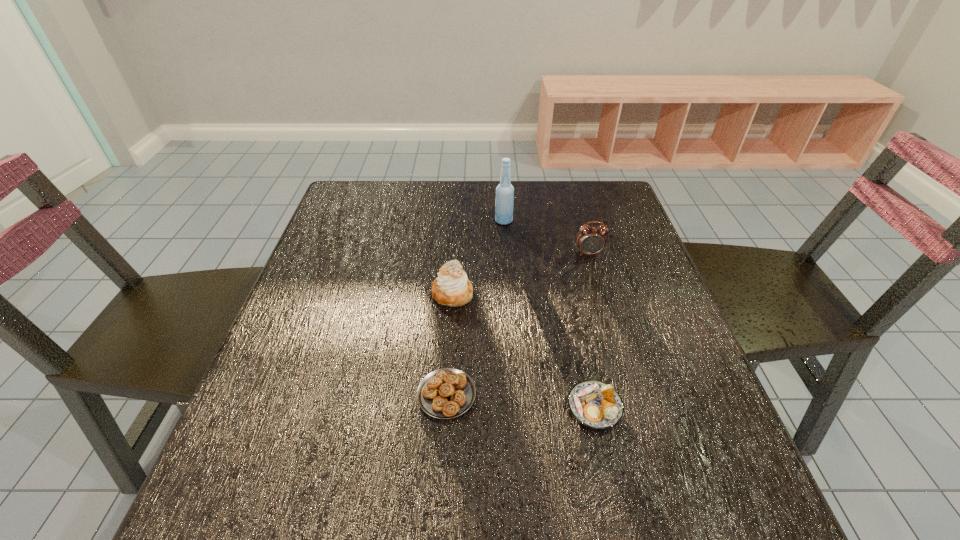
Find the location of a particular element. free space between the rightmost pastry and the tallest object is located at coordinates (549, 314).

At what (x,y) coordinates should I click in order to perform the action: click on free space between the shortest object and the tallest object. Please return your answer as a coordinate pair (x, y). This screenshot has width=960, height=540. Looking at the image, I should click on (475, 307).

The image size is (960, 540). In order to click on vacant point located between the rightmost pastry and the second farthest object in this screenshot , I will do `click(591, 330)`.

I want to click on free space between the farthest object and the alarm clock, so click(546, 237).

This screenshot has width=960, height=540. Find the location of `free space between the shortest object and the tallest object`. free space between the shortest object and the tallest object is located at coordinates (475, 307).

This screenshot has width=960, height=540. In order to click on vacant area that lies between the alarm clock and the rightmost pastry in this screenshot , I will do `click(591, 330)`.

Locate an element on the screen. The width and height of the screenshot is (960, 540). empty space that is in between the rightmost pastry and the farthest pastry is located at coordinates (523, 350).

At what (x,y) coordinates should I click in order to perform the action: click on unoccupied position between the rightmost pastry and the shortest object. Please return your answer as a coordinate pair (x, y). The image size is (960, 540). Looking at the image, I should click on (520, 401).

This screenshot has height=540, width=960. Find the location of `free space between the shortest object and the fourth nearest object`. free space between the shortest object and the fourth nearest object is located at coordinates (517, 324).

The height and width of the screenshot is (540, 960). Find the location of `empty location between the tallest object and the alarm clock`. empty location between the tallest object and the alarm clock is located at coordinates (546, 237).